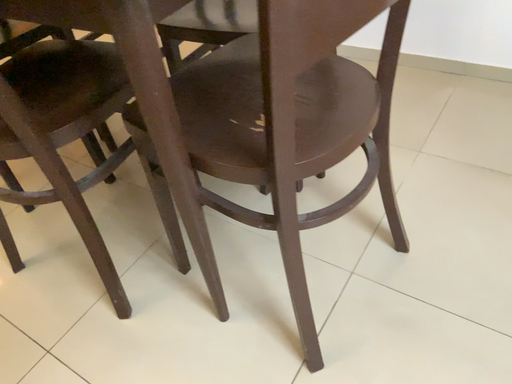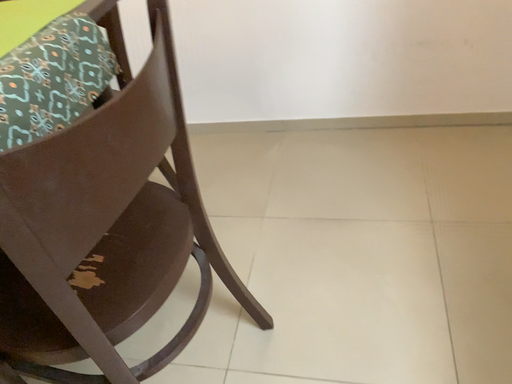
Question: Which way did the camera rotate in the video?

Choices:
 (A) rotated downward
 (B) rotated upward

Answer: (B)